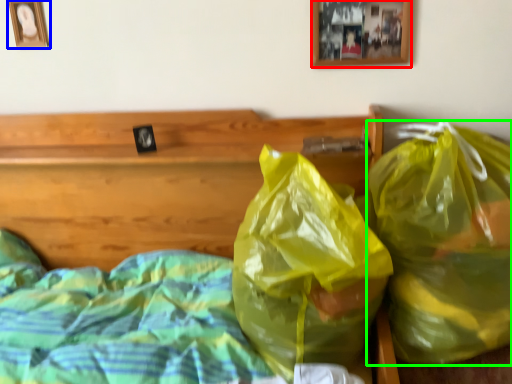
Question: Which is nearer to the picture frame (highlighted by a red box)? picture frame (highlighted by a blue box) or plastic bag (highlighted by a green box).

Choices:
 (A) picture frame
 (B) plastic bag

Answer: (B)